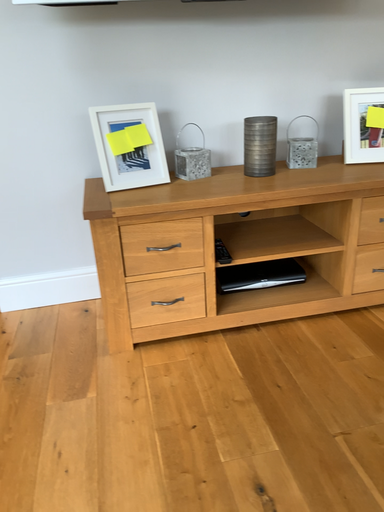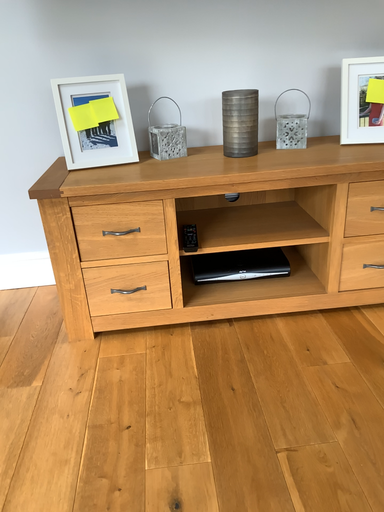
Question: Which way did the camera rotate in the video?

Choices:
 (A) rotated left
 (B) rotated right

Answer: (A)